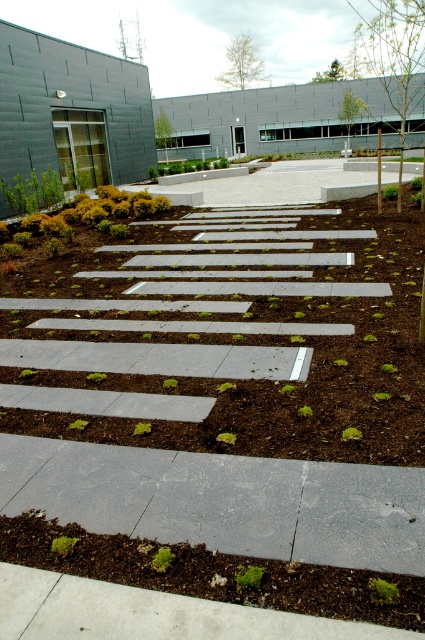
You are designing a garden layout and want to place a small statue between the brown mulch at center and the green mulch at lower center. Which mulch area should the statue be closer to if you want it to appear elevated?

The statue should be closer to the green mulch at lower center because it is taller than the brown mulch at center, providing a natural elevation point.

You are standing at the point marked by the coordinates in the image, which is labeled as point (224, 349). What is the material located at that point?

The material at point (224, 349) is brown mulch.